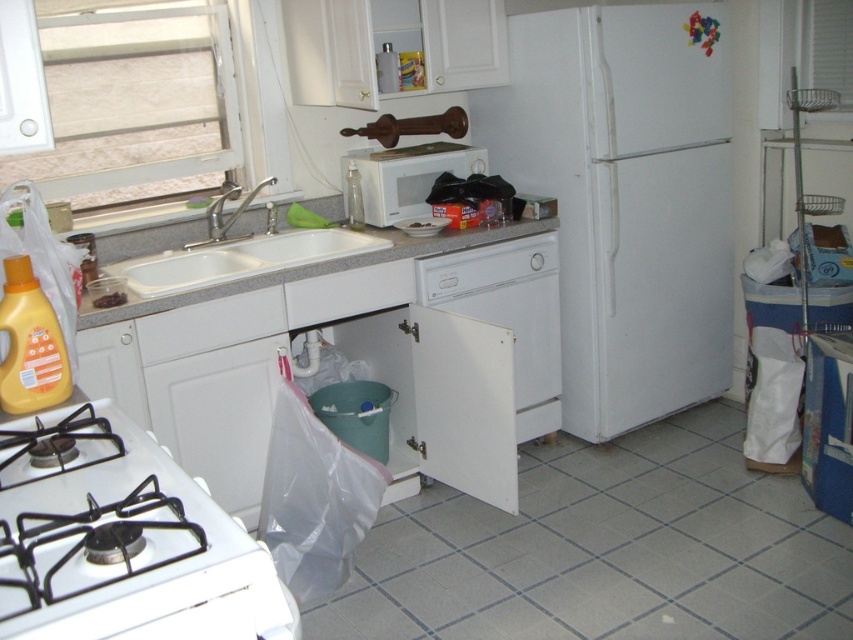
Question: Considering the relative positions of white matte gas stove at lower left and white matte dishwasher at center in the image provided, where is white matte gas stove at lower left located with respect to white matte dishwasher at center?

Choices:
 (A) above
 (B) below

Answer: (B)

Question: Does white matte dishwasher at center appear over gray granite countertop at center?

Choices:
 (A) no
 (B) yes

Answer: (A)

Question: Based on their relative distances, which object is farther from the white matte refrigerator at center right?

Choices:
 (A) white matte dishwasher at center
 (B) white glossy sink at upper left
 (C) gray granite countertop at center

Answer: (B)

Question: Which point appears closest to the camera in this image?

Choices:
 (A) (579, 352)
 (B) (370, 253)
 (C) (309, 230)
 (D) (71, 566)

Answer: (D)

Question: Among these objects, which one is farthest from the camera?

Choices:
 (A) white matte microwave at center
 (B) white glossy sink at upper left
 (C) white matte dishwasher at center

Answer: (A)

Question: Is white matte gas stove at lower left smaller than white matte dishwasher at center?

Choices:
 (A) yes
 (B) no

Answer: (A)